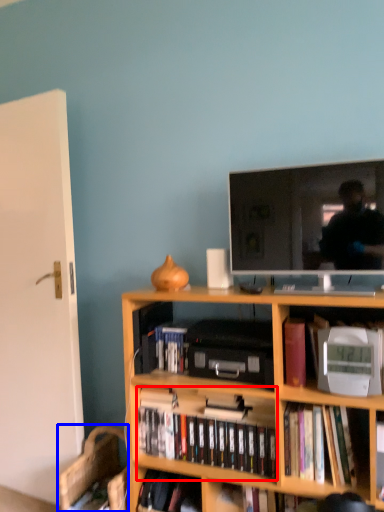
Question: Among these objects, which one is farthest to the camera, book (highlighted by a red box) or computer chair (highlighted by a blue box)?

Choices:
 (A) book
 (B) computer chair

Answer: (B)